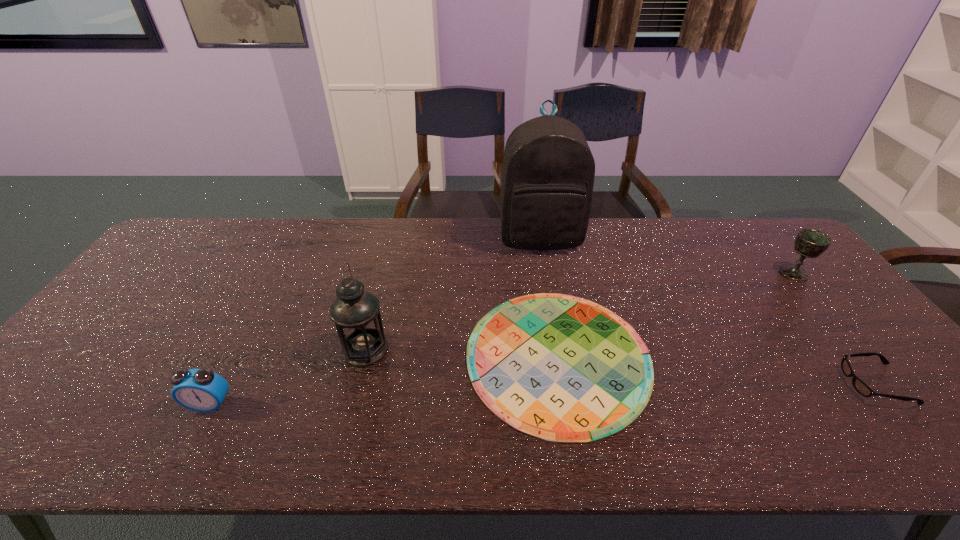
You are a GUI agent. You are given a task and a screenshot of the screen. Output one action in this format:
    pyautogui.click(x=<x>, y=<y>)
    Task: Click on the farthest object
    Image resolution: width=960 pixels, height=540 pixels.
    Given the screenshot: What is the action you would take?
    pyautogui.click(x=548, y=172)

This screenshot has height=540, width=960. I want to click on the tallest object, so click(548, 172).

Image resolution: width=960 pixels, height=540 pixels. Find the location of `oil lamp`. oil lamp is located at coordinates (355, 312).

At what (x,y) coordinates should I click in order to perform the action: click on the fifth shortest object. Please return your answer as a coordinate pair (x, y). The image size is (960, 540). Looking at the image, I should click on (355, 312).

I want to click on the third tallest object, so click(x=811, y=243).

What are the coordinates of `chalice` in the screenshot? It's located at (811, 243).

What are the coordinates of `the third shortest object` in the screenshot? It's located at (202, 390).

Identify the location of the leftmost object. Image resolution: width=960 pixels, height=540 pixels. (202, 390).

Where is `spectacles`? The width and height of the screenshot is (960, 540). spectacles is located at coordinates (863, 389).

You are a GUI agent. You are given a task and a screenshot of the screen. Output one action in this format:
    pyautogui.click(x=<x>, y=<y>)
    Task: Click on the shortest object
    The height and width of the screenshot is (540, 960).
    Given the screenshot: What is the action you would take?
    pyautogui.click(x=561, y=368)